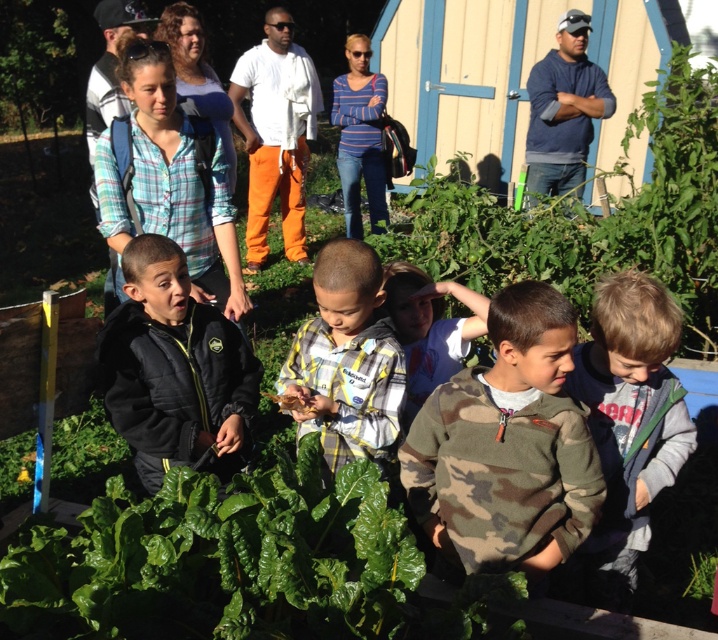
Which is more to the left, blue plaid shirt at upper left or striped cotton shirt at center?

blue plaid shirt at upper left

Does point (107, 164) come closer to viewer compared to point (355, 125)?

Yes, it is in front of point (355, 125).

I want to click on blue plaid shirt at upper left, so click(169, 180).

Can you confirm if white cotton shirt at center is positioned above blue fleece jacket at upper right?

Incorrect, white cotton shirt at center is not positioned above blue fleece jacket at upper right.

Does white cotton shirt at center have a lesser width compared to blue fleece jacket at upper right?

No.

Does point (258, 60) lie in front of point (569, 109)?

No.

This screenshot has height=640, width=718. Find the location of `white cotton shirt at center`. white cotton shirt at center is located at coordinates (275, 132).

Between point (500, 362) and point (265, 116), which one is positioned behind?

The point (265, 116) is behind.

Describe the element at coordinates (508, 445) in the screenshot. I see `camouflage sweater at center` at that location.

Where is `camouflage sweater at center`? The image size is (718, 640). camouflage sweater at center is located at coordinates (508, 445).